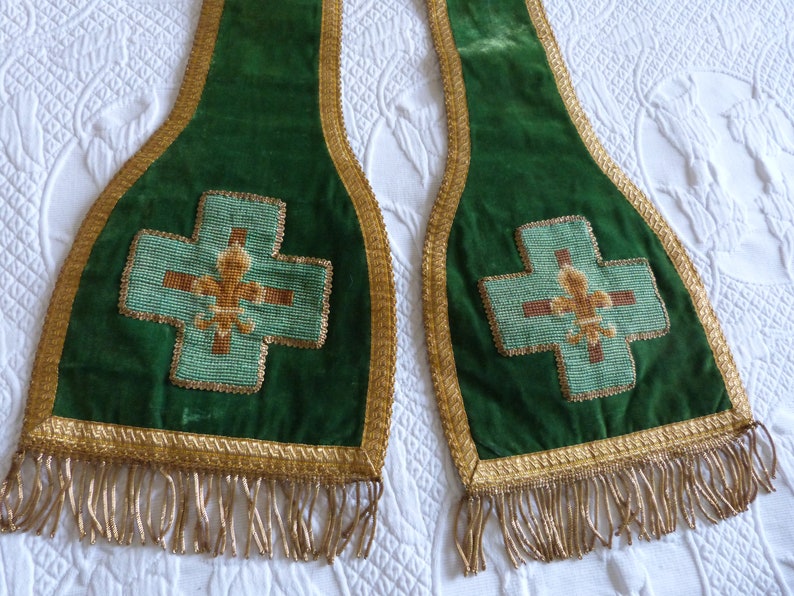
The width and height of the screenshot is (794, 596). What are the coordinates of `white tablecloth` in the screenshot? It's located at tap(642, 74), tap(398, 467), tap(64, 214).